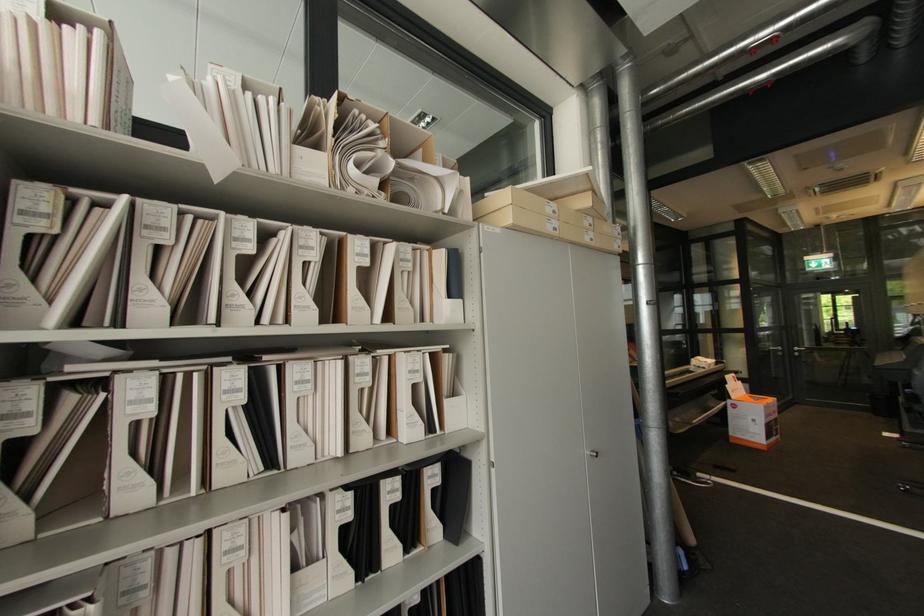
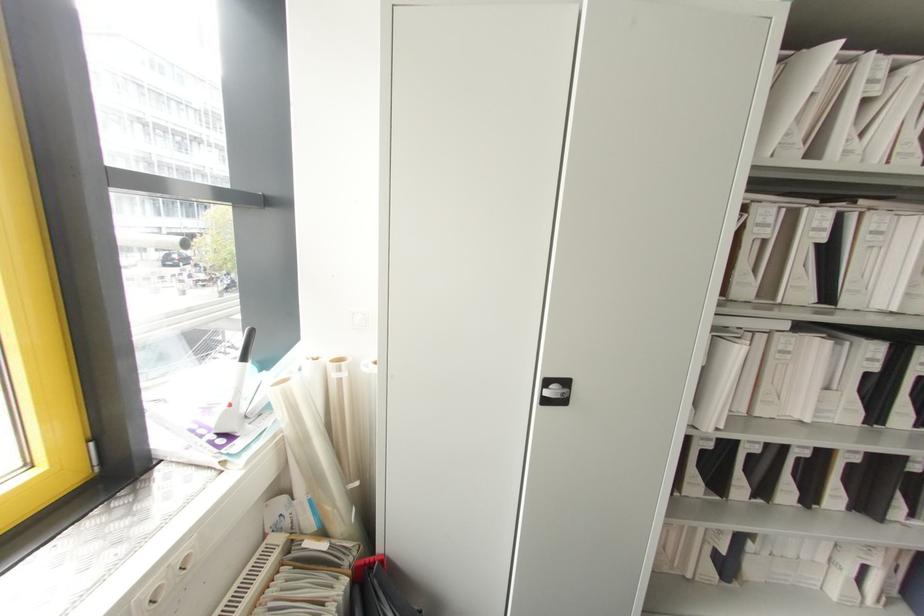
First-person continuous shooting, in which direction is the camera rotating?

The camera's rotation is toward left-down.